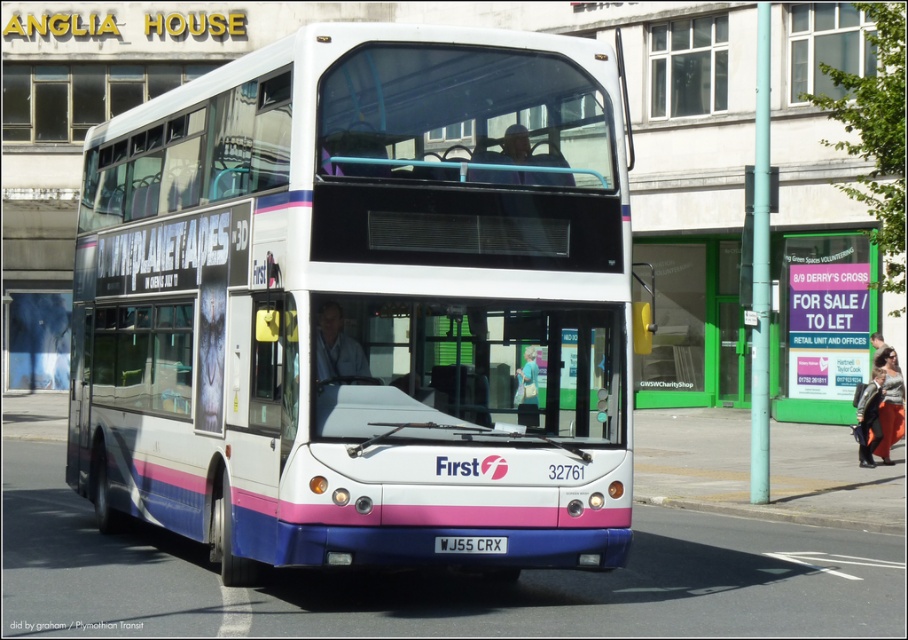
Question: Which object is farther from the camera taking this photo?

Choices:
 (A) white glossy decker bus at center
 (B) white plastic license plate at center

Answer: (A)

Question: Can you confirm if white glossy decker bus at center is thinner than white plastic license plate at center?

Choices:
 (A) yes
 (B) no

Answer: (B)

Question: Observing the image, what is the correct spatial positioning of white glossy decker bus at center in reference to white plastic license plate at center?

Choices:
 (A) below
 (B) above

Answer: (B)

Question: Is white glossy decker bus at center closer to camera compared to white plastic license plate at center?

Choices:
 (A) no
 (B) yes

Answer: (A)